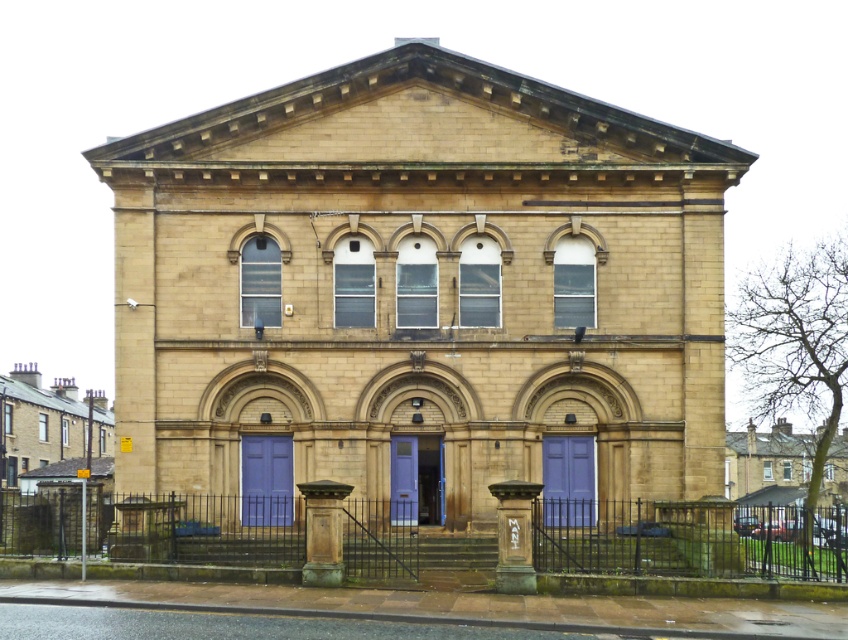
Question: Is matte blue door at center below bronze stone pillar at lower center?

Choices:
 (A) yes
 (B) no

Answer: (B)

Question: Considering the relative positions of matte purple door at center and purple matte door at center in the image provided, where is matte purple door at center located with respect to purple matte door at center?

Choices:
 (A) below
 (B) above

Answer: (A)

Question: Which of the following is the closest to the observer?

Choices:
 (A) (307, 541)
 (B) (414, 467)
 (C) (544, 436)

Answer: (A)

Question: Which point is closer to the camera?

Choices:
 (A) (405, 518)
 (B) (489, 488)
 (C) (544, 468)
 (D) (266, 496)

Answer: (B)

Question: Does matte blue door at center have a smaller size compared to matte purple door at center?

Choices:
 (A) no
 (B) yes

Answer: (A)

Question: Which is farther from the bronze stone pillar at lower center?

Choices:
 (A) matte purple door at center
 (B) purple matte door at center
 (C) bronze/textured pillar at center

Answer: (A)